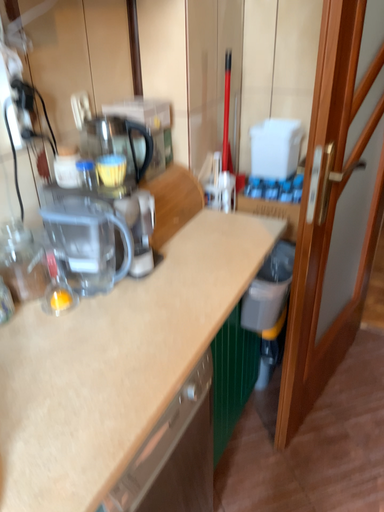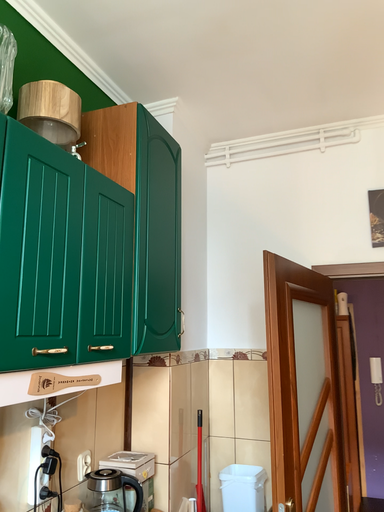
Question: Which way did the camera rotate in the video?

Choices:
 (A) rotated downward
 (B) rotated upward

Answer: (B)